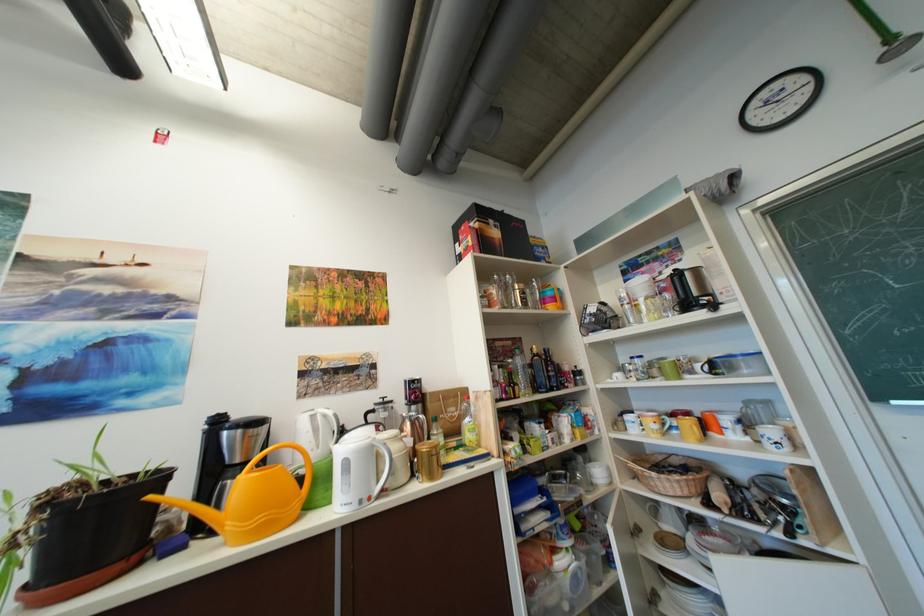
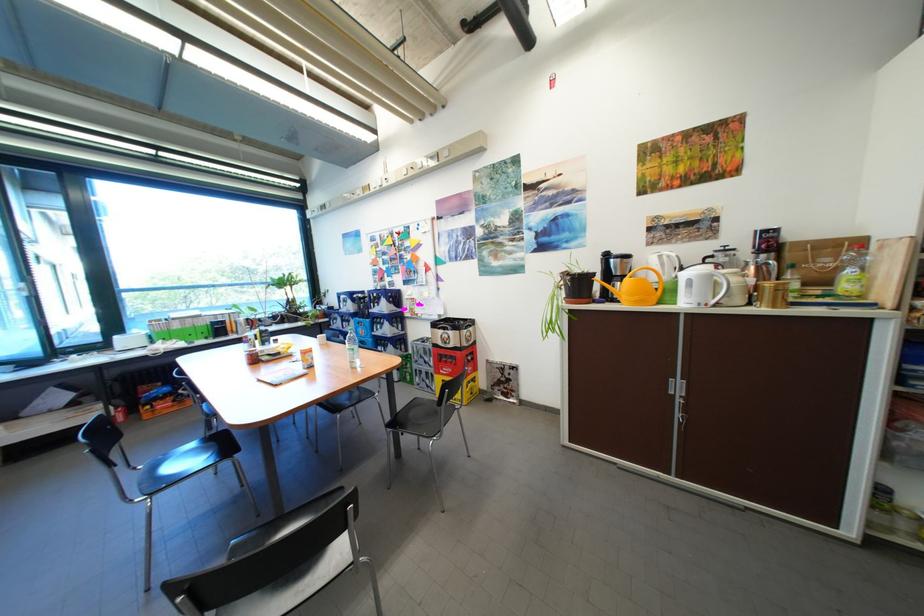
The first image is from the beginning of the video and the second image is from the end. How did the camera likely rotate when shooting the video?

The rotation direction of the camera is left-down.